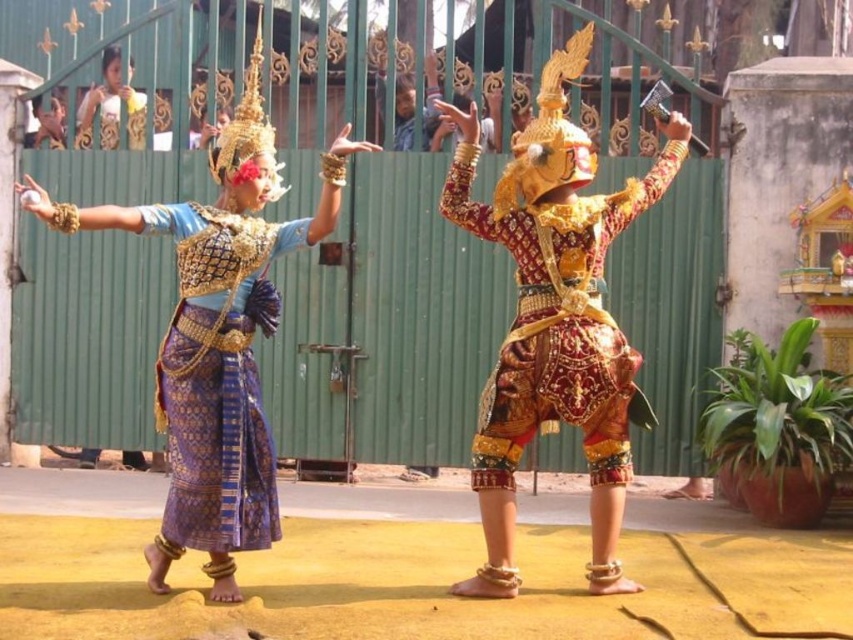
Question: Among these points, which one is nearest to the camera?

Choices:
 (A) (236, 353)
 (B) (601, 476)

Answer: (A)

Question: Is gold textured fabric costume at center thinner than blue silk skirt at left?

Choices:
 (A) yes
 (B) no

Answer: (B)

Question: Is gold textured fabric costume at center further to camera compared to blue silk skirt at left?

Choices:
 (A) no
 (B) yes

Answer: (B)

Question: Which of the following is the closest to the observer?

Choices:
 (A) gold textured fabric costume at center
 (B) blue silk skirt at left

Answer: (B)

Question: In this image, where is gold textured fabric costume at center located relative to blue silk skirt at left?

Choices:
 (A) below
 (B) above

Answer: (B)